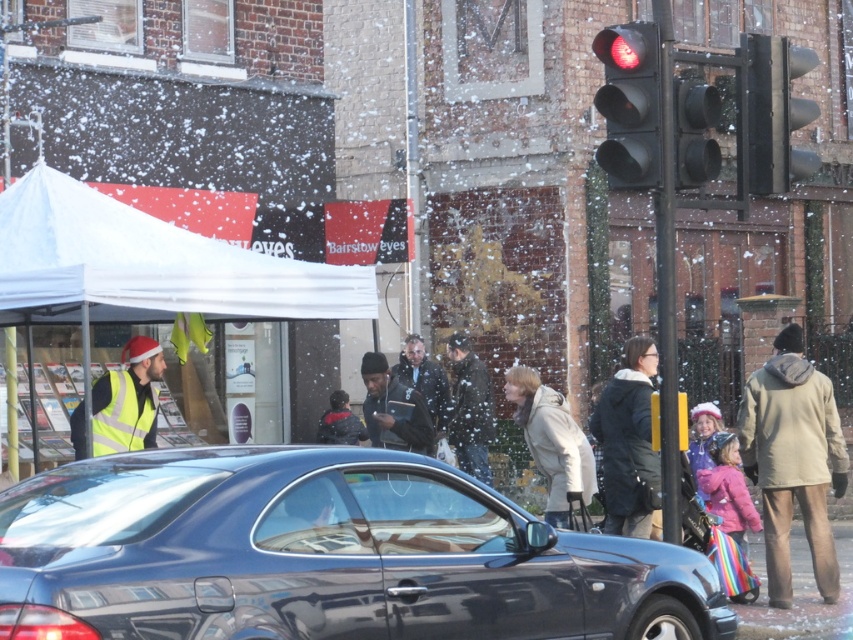
Which is more to the right, white fabric canopy at upper left or yellow reflective vest at left?

Positioned to the right is white fabric canopy at upper left.

The image size is (853, 640). Identify the location of white fabric canopy at upper left. (146, 266).

Which is more to the left, white fabric canopy at upper left or dark gray suit at center?

From the viewer's perspective, white fabric canopy at upper left appears more on the left side.

Which is behind, point (68, 216) or point (416, 356)?

Point (416, 356)

This screenshot has width=853, height=640. Identify the location of white fabric canopy at upper left. (146, 266).

From the picture: How much distance is there between white fabric canopy at upper left and beige wool coat at right?

They are 3.81 meters apart.

Is white fabric canopy at upper left taller than beige wool coat at right?

In fact, white fabric canopy at upper left may be shorter than beige wool coat at right.

Is point (80, 392) closer to camera compared to point (827, 451)?

No, it is not.

I want to click on white fabric canopy at upper left, so click(146, 266).